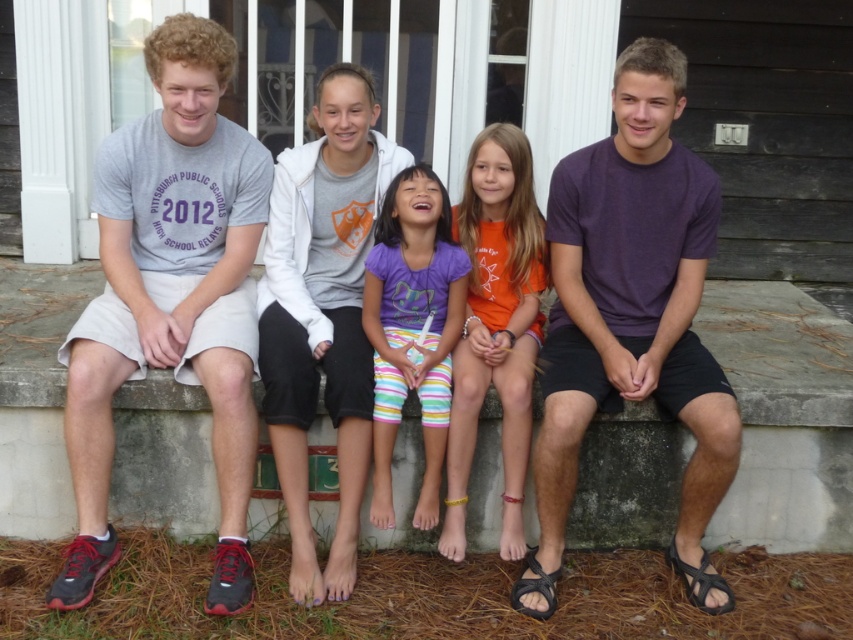
What is the color of the shirt worn by the person located at point (631, 316)?

The purple cotton shirt at right is located at point (631, 316), so the color is purple.

You are standing at the point with coordinates point [372,84] and want to walk to the point with coordinates point [674,204]. Which direction should you move to reach your destination?

You should move forward because point [674,204] is in front of point [372,84].